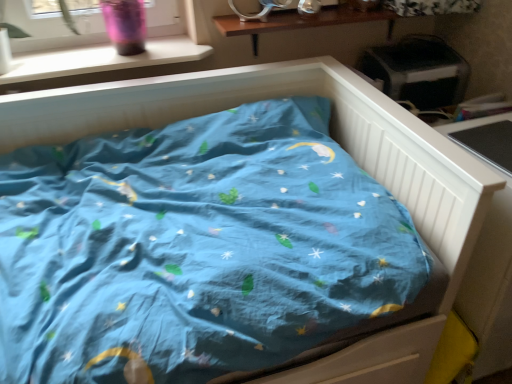
Question: Can you see white plastic window sill at upper left touching white wooden table at right?

Choices:
 (A) yes
 (B) no

Answer: (B)

Question: Can you confirm if white plastic window sill at upper left is positioned to the left of white wooden table at right?

Choices:
 (A) no
 (B) yes

Answer: (B)

Question: Is white plastic window sill at upper left further to the viewer compared to white wooden table at right?

Choices:
 (A) yes
 (B) no

Answer: (A)

Question: Are white plastic window sill at upper left and white wooden table at right located far from each other?

Choices:
 (A) no
 (B) yes

Answer: (B)

Question: Is white plastic window sill at upper left facing away from white wooden table at right?

Choices:
 (A) yes
 (B) no

Answer: (B)

Question: From the image's perspective, would you say white plastic window sill at upper left is shown under white wooden table at right?

Choices:
 (A) no
 (B) yes

Answer: (A)

Question: Considering the relative sizes of white wooden table at right and white plastic window sill at upper left in the image provided, is white wooden table at right thinner than white plastic window sill at upper left?

Choices:
 (A) no
 (B) yes

Answer: (A)

Question: Is white wooden table at right smaller than white plastic window sill at upper left?

Choices:
 (A) yes
 (B) no

Answer: (B)

Question: Can you see white wooden table at right touching white plastic window sill at upper left?

Choices:
 (A) yes
 (B) no

Answer: (B)

Question: Considering the relative sizes of white wooden table at right and white plastic window sill at upper left in the image provided, is white wooden table at right bigger than white plastic window sill at upper left?

Choices:
 (A) no
 (B) yes

Answer: (B)

Question: Is white wooden table at right shorter than white plastic window sill at upper left?

Choices:
 (A) no
 (B) yes

Answer: (A)

Question: Can you confirm if white wooden table at right is positioned to the left of white plastic window sill at upper left?

Choices:
 (A) no
 (B) yes

Answer: (A)

Question: From their relative heights in the image, would you say white plastic window sill at upper left is taller or shorter than white wooden table at right?

Choices:
 (A) short
 (B) tall

Answer: (A)